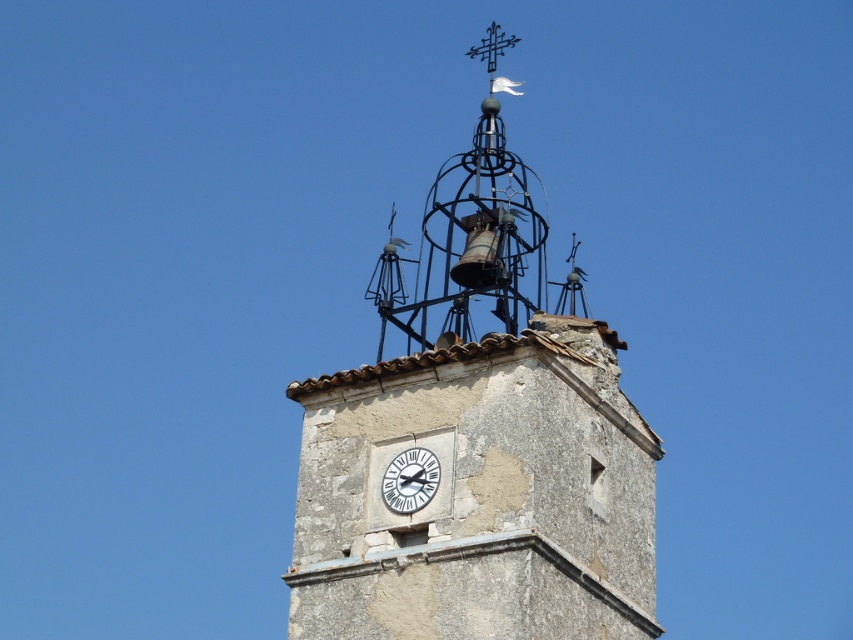
You are standing at the origin point of a coordinate system placed at the bottom left corner of the image. The image has a width of 1000 pixels and a height of 800 pixels. You need to locate the stone clock tower at center. What are the pixel coordinates of its position?

The stone clock tower at center is located at coordinates calculated by multiplying the given point values by the image dimensions. The x coordinate is 0.686 multiplied by 1000 pixels, which equals 686 pixels. The y coordinate is 0.560 multiplied by 800 pixels, resulting in 448 pixels. Therefore, the pixel coordinates are approximately (852, 639).

You are standing in front of the clock tower and notice two points marked on the tower. The first point is at coordinate point (335, 448) and the second is at point (402, 512). Which point is closer to you?

Point (335, 448) is closer to you because it is further to the viewer than point (402, 512).